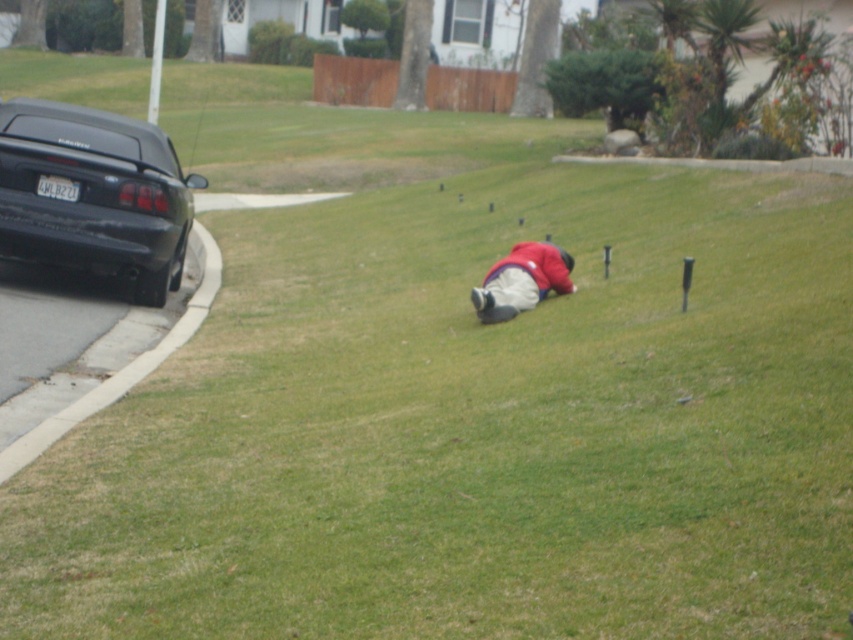
You are a delivery person needing to place a 1.2 meter tall package between the black matte car at left and the red matte jacket at center. Can the package fit vertically between them based on their heights?

The black matte car at left is taller than the red matte jacket at center. Since the package is 1.2 meters tall, and the car is taller than the jacket, the minimum height available between them would be determined by the jacket. If the jacket is shorter than 1.2 meters, the package might not fit. However, without exact measurements of the jacket or the space between them, it is uncertain. The description only states the car is taller than the jacket but does not provide specific heights, so we cannot be 100